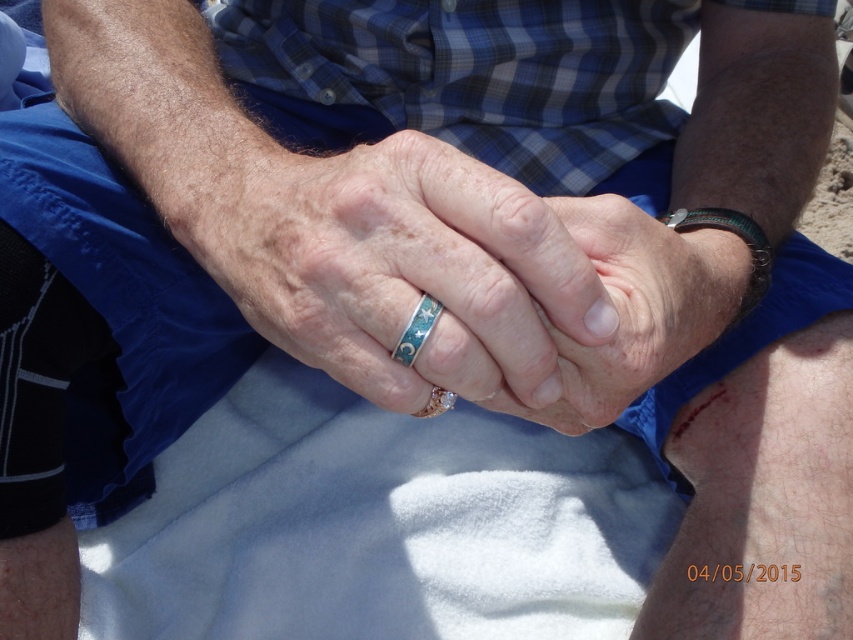
Is green leather bracelet at upper right in front of green enamel ring at center?

No, green leather bracelet at upper right is further to the viewer.

Can you confirm if green leather bracelet at upper right is positioned below green enamel ring at center?

No, green leather bracelet at upper right is not below green enamel ring at center.

What are the coordinates of `green leather bracelet at upper right` in the screenshot? It's located at (738, 236).

The image size is (853, 640). Find the location of `turquoise glossy ring at center`. turquoise glossy ring at center is located at coordinates (637, 308).

Does turquoise glossy ring at center come in front of green leather bracelet at upper right?

Yes.

Where is `turquoise glossy ring at center`? turquoise glossy ring at center is located at coordinates (637, 308).